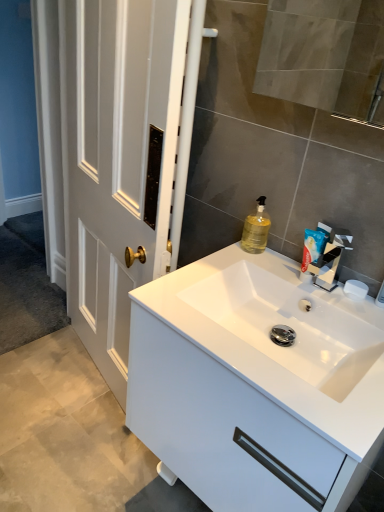
At what (x,y) coordinates should I click in order to perform the action: click on vacant space that is to the left of white matte soap at right. Please return your answer as a coordinate pair (x, y). This screenshot has height=512, width=384. Looking at the image, I should click on (300, 282).